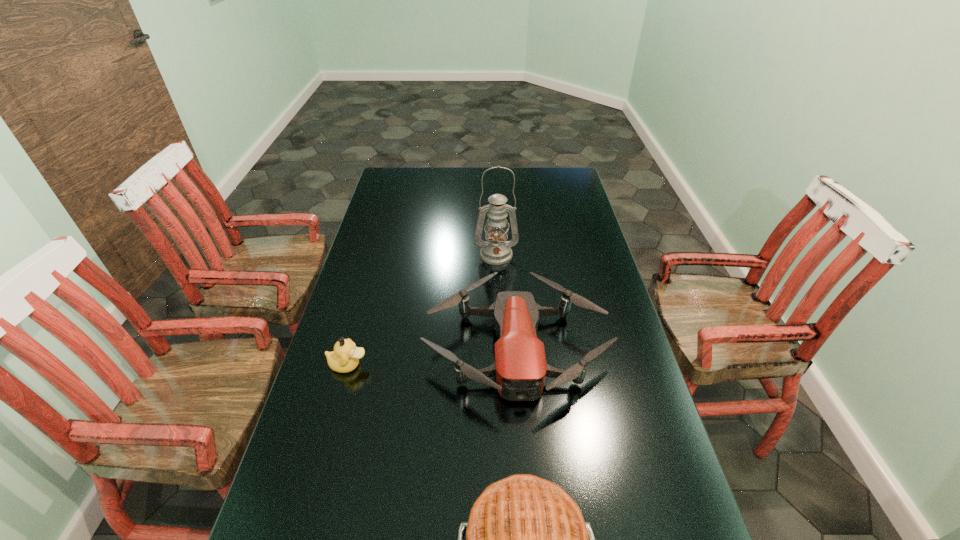
Locate an element on the screen. The height and width of the screenshot is (540, 960). the farthest object is located at coordinates (496, 250).

Find the location of a particular element. oil lamp is located at coordinates (496, 250).

Identify the location of drone. (520, 368).

You are a GUI agent. You are given a task and a screenshot of the screen. Output one action in this format:
    pyautogui.click(x=<x>, y=<y>)
    Task: Click on the leftmost object
    
    Given the screenshot: What is the action you would take?
    pyautogui.click(x=345, y=358)

At what (x,y) coordinates should I click in order to perform the action: click on free space located 0.280m on the left of the farthest object. Please return your answer as a coordinate pair (x, y). This screenshot has width=960, height=540. Looking at the image, I should click on tap(397, 255).

The width and height of the screenshot is (960, 540). In order to click on free space located 0.250m on the front-facing side of the drone in this screenshot , I will do `click(530, 519)`.

The width and height of the screenshot is (960, 540). Find the location of `free space located on the face of the duckling`. free space located on the face of the duckling is located at coordinates (509, 365).

This screenshot has width=960, height=540. I want to click on object situated at the left edge, so click(345, 358).

Where is `object that is at the right edge`? object that is at the right edge is located at coordinates (520, 368).

In order to click on vacant space at the far edge in this screenshot , I will do `click(500, 191)`.